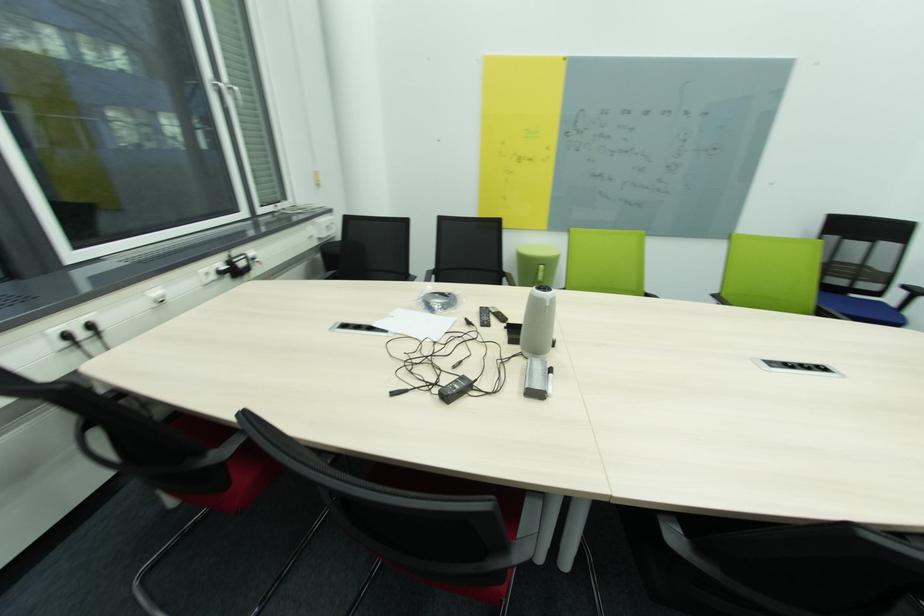
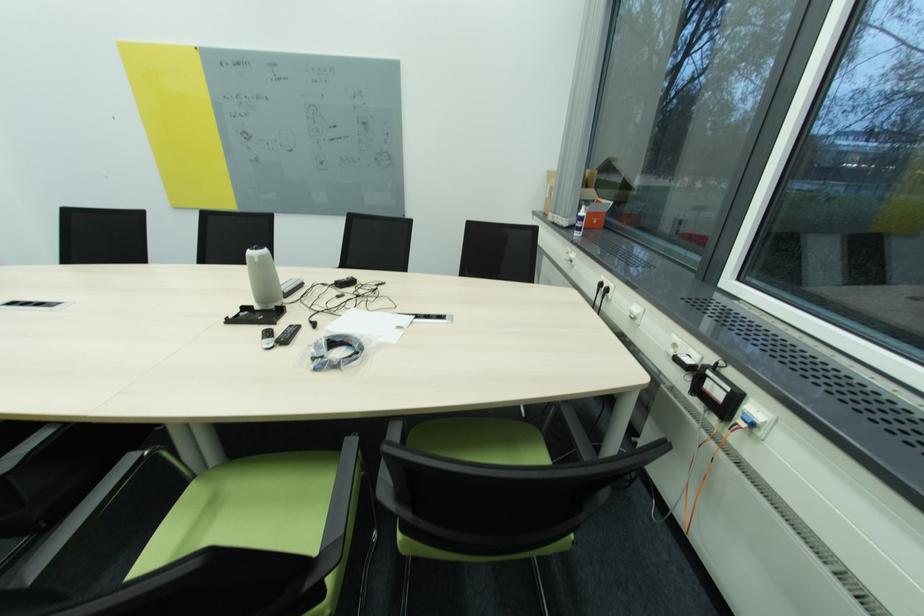
Find the pixel in the second image that matches point 71,338 in the first image.

(604, 286)